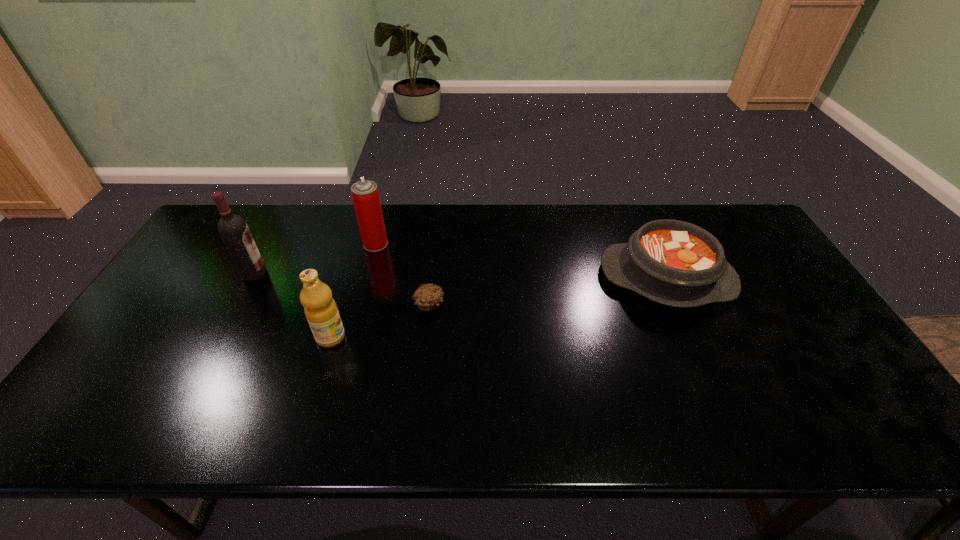
Find the location of `the leftmost object`. the leftmost object is located at coordinates (233, 229).

Identify the location of aerosol can. The height and width of the screenshot is (540, 960). (365, 194).

Identify the location of olive oil. The image size is (960, 540). (321, 311).

At what (x,y) coordinates should I click in order to perform the action: click on the rightmost object. Please return your answer as a coordinate pair (x, y). Looking at the image, I should click on (675, 263).

What are the coordinates of `casserole` in the screenshot? It's located at (675, 263).

The height and width of the screenshot is (540, 960). In order to click on the fourth object from left to right in this screenshot , I will do `click(427, 297)`.

Find the location of `muffin`. muffin is located at coordinates (427, 297).

Identify the location of vacant region located on the label of the wine bottle. This screenshot has height=540, width=960. (349, 273).

At what (x,y) coordinates should I click in order to perform the action: click on free spot located on the left of the aerosol can. Please return your answer as a coordinate pair (x, y). The width and height of the screenshot is (960, 540). Looking at the image, I should click on pos(258,244).

The width and height of the screenshot is (960, 540). Identify the location of free region located 0.120m on the label of the olive oil. (391, 337).